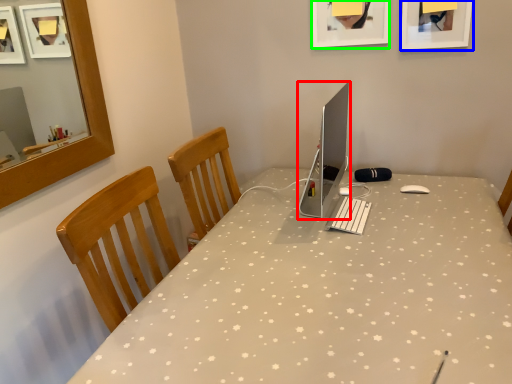
Question: Estimate the real-world distances between objects in this image. Which object is closer to computer monitor (highlighted by a red box), picture frame (highlighted by a blue box) or picture frame (highlighted by a green box)?

Choices:
 (A) picture frame
 (B) picture frame

Answer: (B)